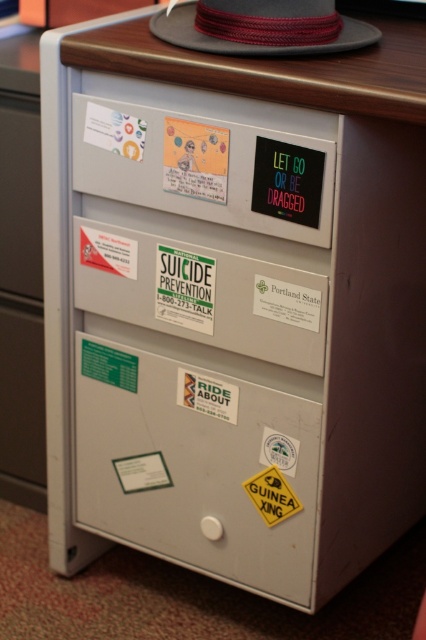
Question: Which point appears farthest from the camera in this image?

Choices:
 (A) (166, 310)
 (B) (291, 490)
 (C) (207, 0)

Answer: (A)

Question: Can you confirm if white matte drawer at center is positioned above gray felt fedora at upper center?

Choices:
 (A) no
 (B) yes

Answer: (A)

Question: Can you confirm if white matte drawer at center is positioned to the left of gray felt fedora at upper center?

Choices:
 (A) no
 (B) yes

Answer: (B)

Question: Which of the following is the closest to the observer?

Choices:
 (A) (173, 321)
 (B) (310, 49)

Answer: (B)

Question: Can you confirm if gray felt fedora at upper center is positioned below yellow paper sign at lower center?

Choices:
 (A) yes
 (B) no

Answer: (B)

Question: Which point is farther to the camera?

Choices:
 (A) (183, 266)
 (B) (290, 512)
 (C) (321, 44)

Answer: (B)